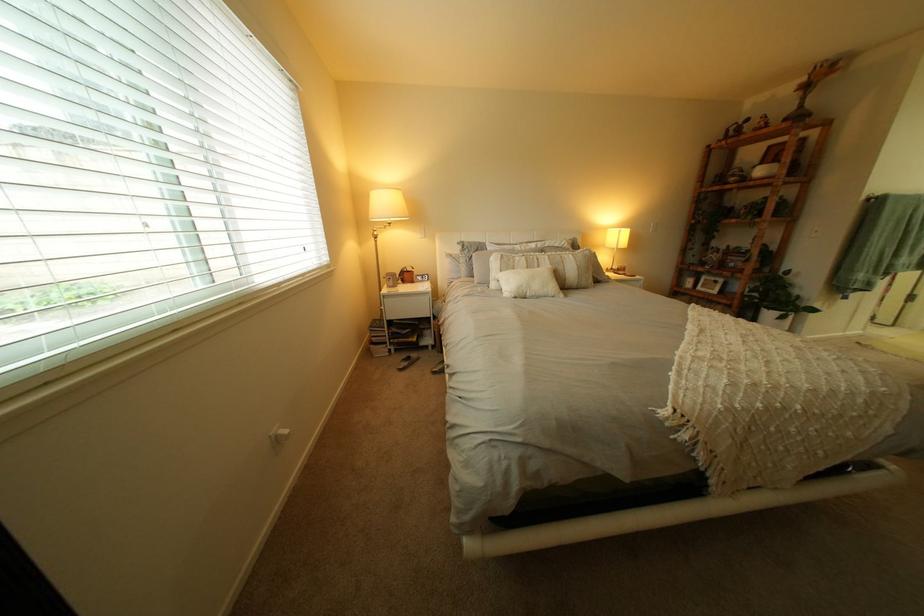
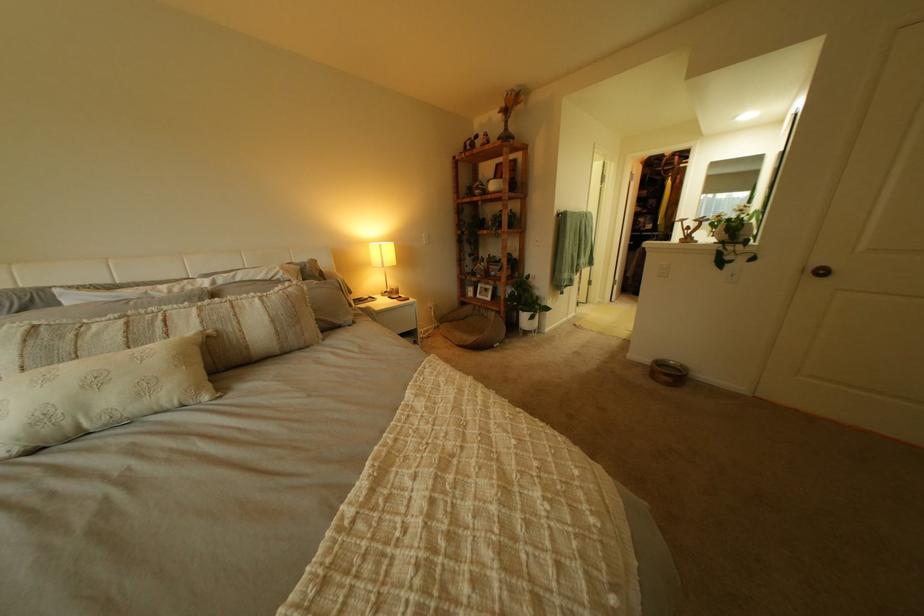
In the second image, find the point that corresponds to point 622,229 in the first image.

(381, 244)